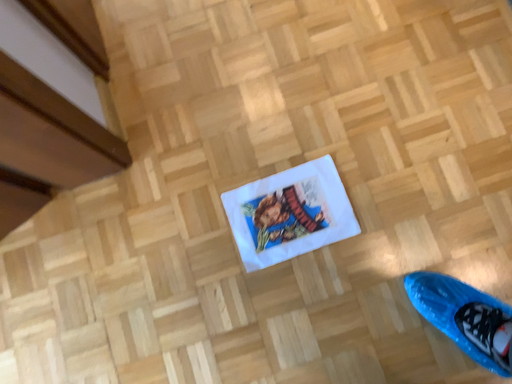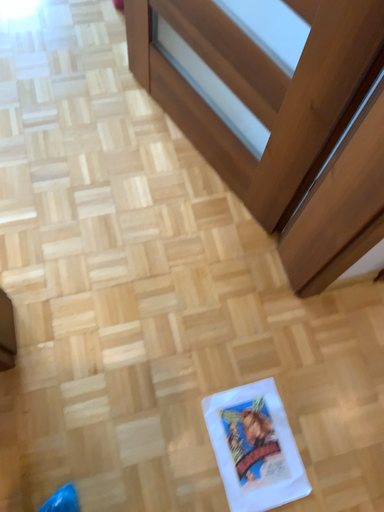
Question: Which way did the camera rotate in the video?

Choices:
 (A) rotated upward
 (B) rotated downward

Answer: (A)